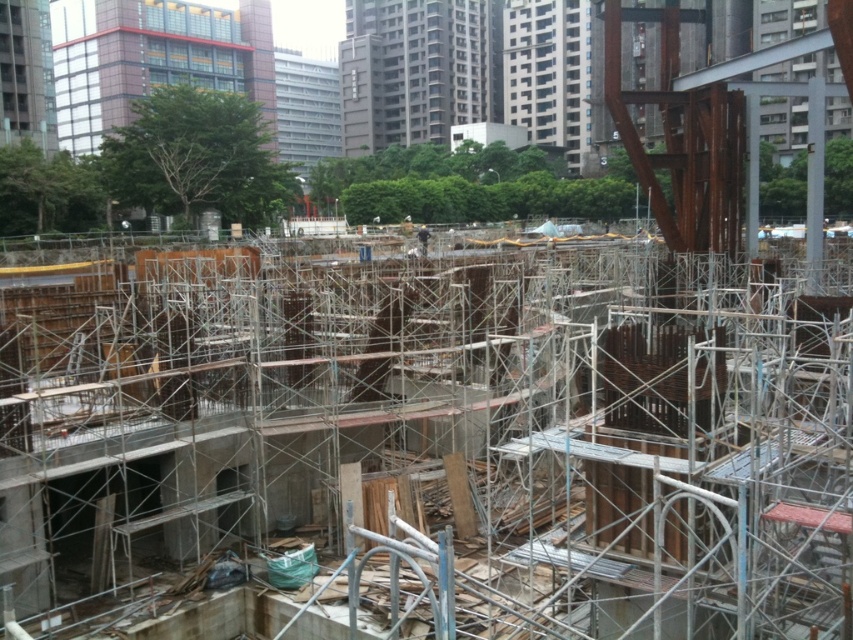
Question: Does metal scaffolding at center appear on the right side of dark blue uniform at center?

Choices:
 (A) yes
 (B) no

Answer: (A)

Question: Among these points, which one is nearest to the camera?

Choices:
 (A) (421, 246)
 (B) (666, 276)

Answer: (B)

Question: Among these points, which one is nearest to the camera?

Choices:
 (A) (419, 250)
 (B) (360, 513)

Answer: (B)

Question: Among these points, which one is nearest to the camera?

Choices:
 (A) (422, 241)
 (B) (676, 300)

Answer: (B)

Question: Is metal scaffolding at center bigger than dark blue uniform at center?

Choices:
 (A) yes
 (B) no

Answer: (A)

Question: Can you confirm if metal scaffolding at center is positioned to the right of dark blue uniform at center?

Choices:
 (A) yes
 (B) no

Answer: (A)